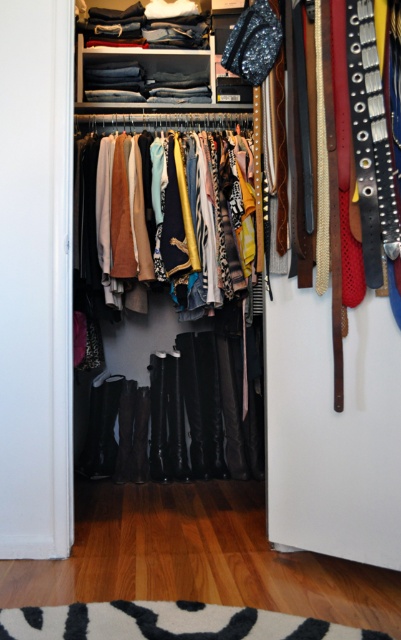
Between matte black pants at center and textured wool sweater at center, which one has more height?

With more height is matte black pants at center.

Between matte black pants at center and textured wool sweater at center, which one has less height?

textured wool sweater at center is shorter.

Is point (295, 444) positioned behind point (125, 252)?

No, (295, 444) is in front of (125, 252).

Find the location of `matte black pants at center`. matte black pants at center is located at coordinates (332, 428).

Is white soft rug at lower center positioned in front of textured wool sweater at center?

Yes, it is.

Is point (208, 616) more distant than point (141, 173)?

No, it is in front of (141, 173).

I want to click on white soft rug at lower center, so click(x=168, y=621).

Is matte black pants at center thinner than white soft rug at lower center?

Yes.

Between matte black pants at center and white soft rug at lower center, which one appears on the right side from the viewer's perspective?

From the viewer's perspective, matte black pants at center appears more on the right side.

At what (x,y) coordinates should I click in order to perform the action: click on matte black pants at center. Please return your answer as a coordinate pair (x, y). This screenshot has width=401, height=640. Looking at the image, I should click on (332, 428).